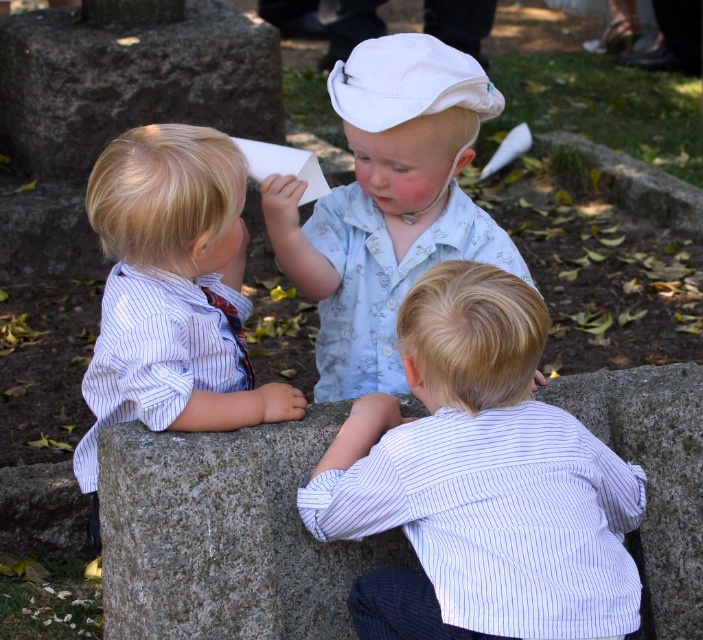
Question: Is gray granite stone at center further to camera compared to light blue floral shirt at center?

Choices:
 (A) no
 (B) yes

Answer: (A)

Question: Which point is closer to the camera?

Choices:
 (A) (221, 200)
 (B) (32, 51)

Answer: (A)

Question: Can you confirm if white striped shirt at center is bigger than gray granite stone at center?

Choices:
 (A) no
 (B) yes

Answer: (B)

Question: Can you confirm if gray granite stone at center is positioned above granite stone at upper left?

Choices:
 (A) no
 (B) yes

Answer: (A)

Question: Which of the following is the closest to the observer?

Choices:
 (A) gray granite stone at center
 (B) white striped shirt at center

Answer: (B)

Question: Which object appears farthest from the camera in this image?

Choices:
 (A) granite stone at upper left
 (B) gray granite stone at center
 (C) light blue floral shirt at center

Answer: (A)